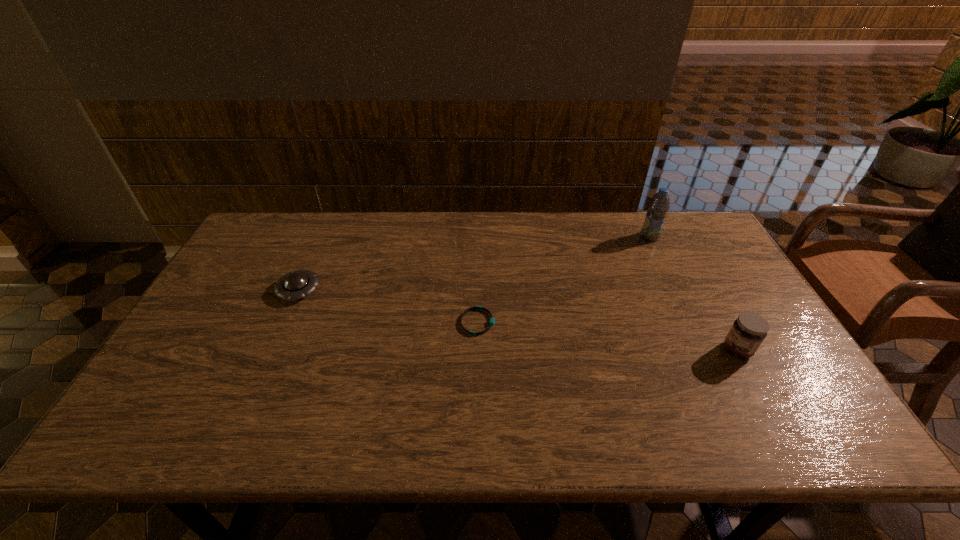
Find the location of `free space at the far left corner`. free space at the far left corner is located at coordinates (269, 235).

Identify the location of vacant area at the near left corner. [125, 426].

In the image, there is a desktop. Where is `vacant region at the near right corner`? The image size is (960, 540). vacant region at the near right corner is located at coordinates (766, 416).

Locate an element on the screen. free space between the leftmost object and the water bottle is located at coordinates (474, 264).

Where is `free space between the second object from left to right and the third shortest object`? The image size is (960, 540). free space between the second object from left to right and the third shortest object is located at coordinates (608, 336).

You are a GUI agent. You are given a task and a screenshot of the screen. Output one action in this format:
    pyautogui.click(x=<x>, y=<y>)
    Task: Click on the blank region between the wristband and the second farthest object
    
    Given the screenshot: What is the action you would take?
    pyautogui.click(x=388, y=306)

The height and width of the screenshot is (540, 960). Identify the location of vacant space in between the rightmost object and the water bottle. (693, 293).

The width and height of the screenshot is (960, 540). I want to click on free space between the water bottle and the second shortest object, so click(x=474, y=264).

Identify the location of unoccupied position between the saucer and the farthest object. [x=474, y=264].

Find the location of a particular element. Image resolution: width=960 pixels, height=540 pixels. free space between the jam and the second shortest object is located at coordinates (518, 320).